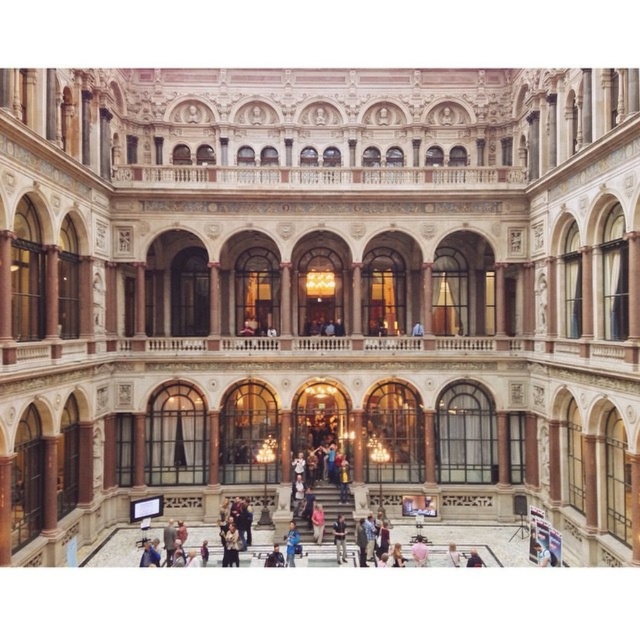
Who is shorter, brown fur coat at lower center or light brown leather jacket at lower center?

With less height is brown fur coat at lower center.

Can you confirm if brown fur coat at lower center is shorter than light brown leather jacket at lower center?

Yes.

Between point (237, 536) and point (298, 540), which one is positioned behind?

The point (298, 540) is behind.

Where is `brown fur coat at lower center`? The image size is (640, 640). brown fur coat at lower center is located at coordinates (230, 545).

Is brown fur coat at lower center thinner than dark blue shirt at center?

Yes, brown fur coat at lower center is thinner than dark blue shirt at center.

Is brown fur coat at lower center wider than dark blue shirt at center?

No.

Between point (237, 532) and point (344, 561), which one is positioned behind?

The point (237, 532) is more distant.

This screenshot has height=640, width=640. Find the location of `brown fur coat at lower center`. brown fur coat at lower center is located at coordinates (230, 545).

Is point (339, 545) farther from viewer compared to point (292, 525)?

That is False.

Is point (344, 536) less distant than point (300, 552)?

No, (344, 536) is further to viewer.

Where is `dark blue shirt at center`? The height and width of the screenshot is (640, 640). dark blue shirt at center is located at coordinates (339, 538).